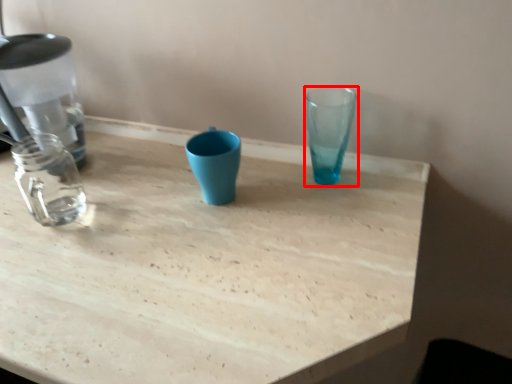
Question: From the image, what is the correct spatial relationship of vase (annotated by the red box) in relation to table?

Choices:
 (A) right
 (B) left

Answer: (A)